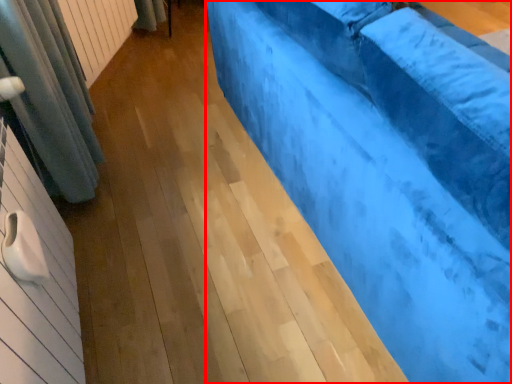
Question: From the image's perspective, considering the relative positions of furniture (annotated by the red box) and radiator in the image provided, where is furniture (annotated by the red box) located with respect to the staircase?

Choices:
 (A) below
 (B) above

Answer: (A)